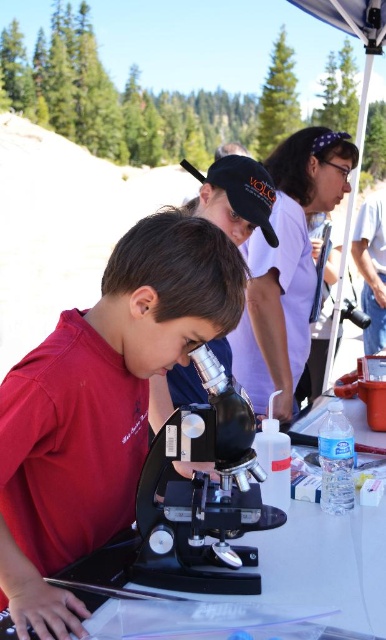
You are a participant in the science activity and want to use the microscope closest to you. Which one should you choose between the matte black microscope at center and the black metallic microscope at center?

You should choose the matte black microscope at center because it is in front of the black metallic microscope at center, making it closer to you.

From the picture: You are organizing a science fair booth and need to arrange equipment and participants. Given the black metallic microscope at center and the matte purple shirt at upper center, which object occupies more horizontal space in the image?

The matte purple shirt at upper center occupies more horizontal space because it is wider than the black metallic microscope at center.

You are a participant in the science activity and need to choose between the matte black microscope at center and the black metallic microscope at center based on their height. Which one should you select if you prefer a taller microscope?

The matte black microscope at center is taller than the black metallic microscope at center, so you should select the matte black microscope at center.